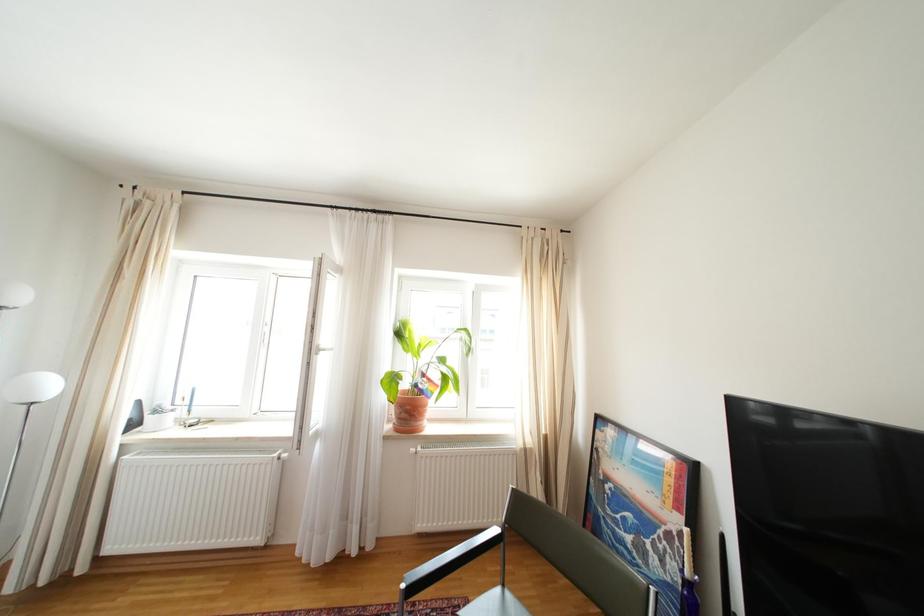
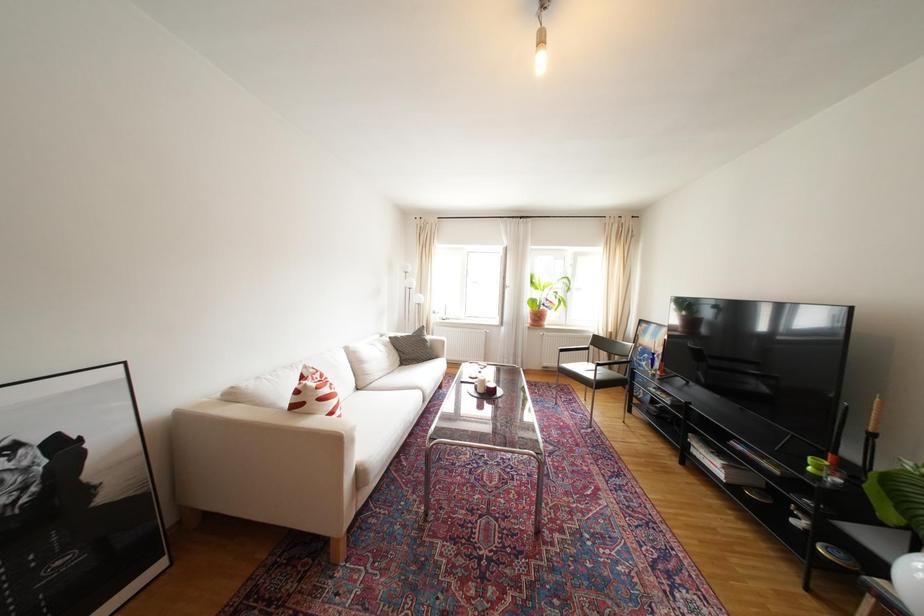
Question: Which direction would the cameraman need to move to produce the second image? Reply with the corresponding letter.

Choices:
 (A) Left
 (B) Right
 (C) Forward
 (D) Backward

Answer: (D)